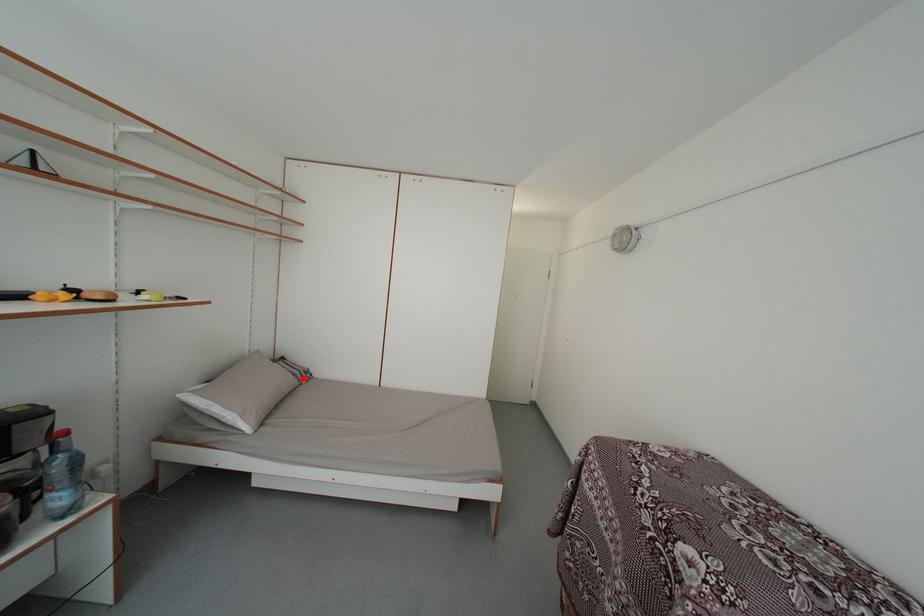
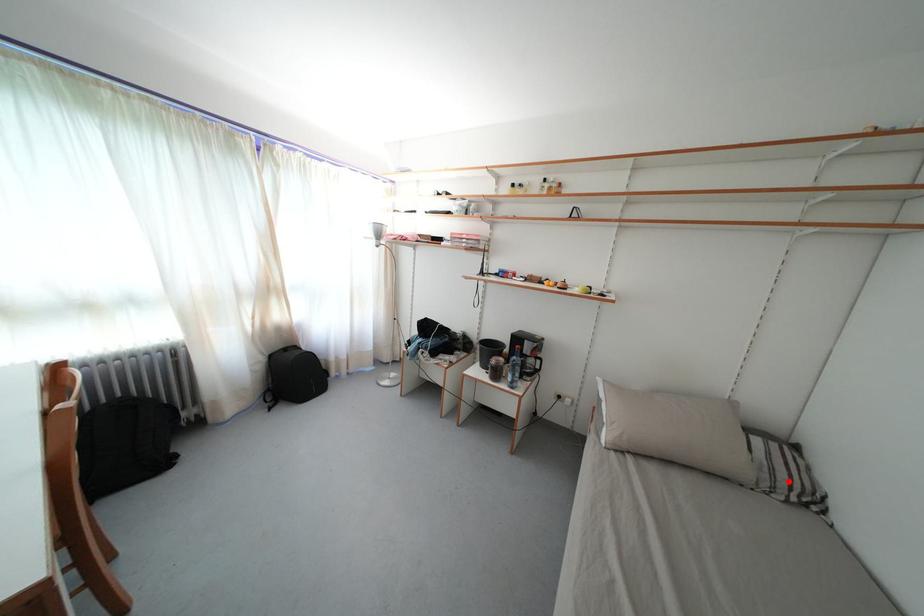
I am providing you with two images of the same scene from different viewpoints. A red point is marked on the first image and another point is marked on the second image. Do the highlighted points in image1 and image2 indicate the same real-world spot?

Yes